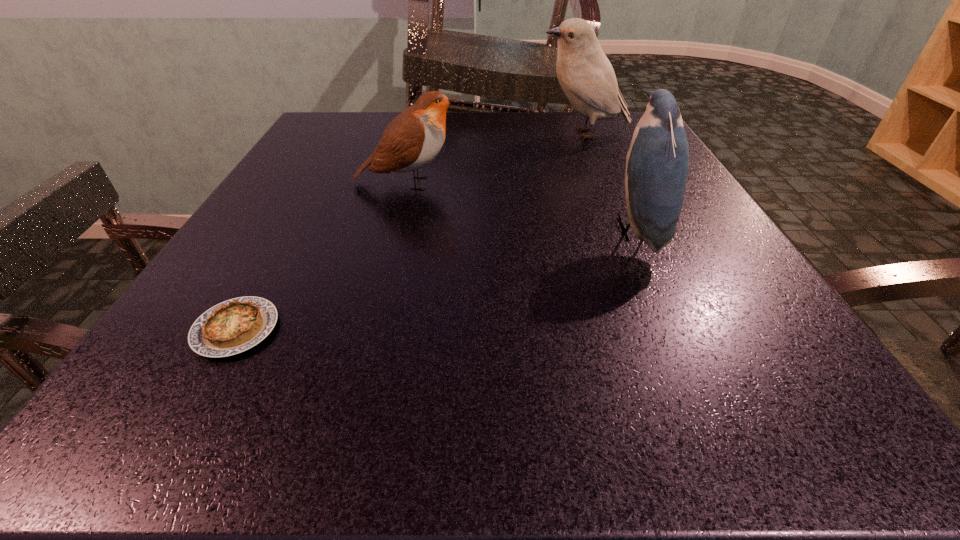
The height and width of the screenshot is (540, 960). Find the location of `vacant space located at the tip of the third farthest object's beak`. vacant space located at the tip of the third farthest object's beak is located at coordinates (436, 230).

Locate an element on the screen. The image size is (960, 540). blank area located 0.110m at the tip of the third farthest object's beak is located at coordinates (544, 230).

What are the coordinates of `free space located at the face of the second object from left to right` in the screenshot? It's located at (636, 183).

This screenshot has height=540, width=960. What are the coordinates of `free space located 0.300m on the right of the shortest object` in the screenshot? It's located at (512, 329).

Locate an element on the screen. object at the far edge is located at coordinates (585, 74).

The height and width of the screenshot is (540, 960). Identify the location of bird that is at the left edge. (413, 139).

Where is `quiche that is positioned at the left edge`? quiche that is positioned at the left edge is located at coordinates (233, 326).

Image resolution: width=960 pixels, height=540 pixels. I want to click on object situated at the far right corner, so click(x=585, y=74).

Identify the location of vacant space at the far edge of the desktop. (516, 142).

In order to click on vacant area at the near edge in this screenshot , I will do `click(657, 426)`.